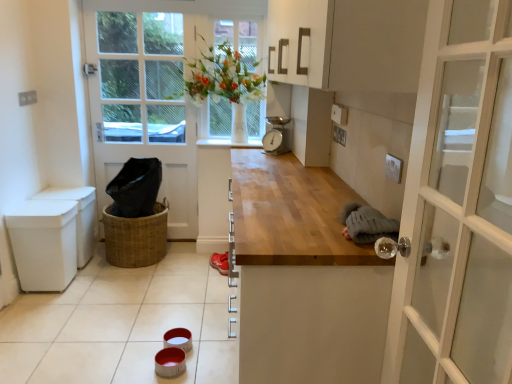
Question: Is translucent glass window at center outside of metallic gray scale at upper center?

Choices:
 (A) yes
 (B) no

Answer: (A)

Question: Considering the relative positions of translucent glass window at center and metallic gray scale at upper center in the image provided, is translucent glass window at center to the right of metallic gray scale at upper center from the viewer's perspective?

Choices:
 (A) no
 (B) yes

Answer: (A)

Question: Considering the relative sizes of translucent glass window at center and metallic gray scale at upper center in the image provided, is translucent glass window at center shorter than metallic gray scale at upper center?

Choices:
 (A) no
 (B) yes

Answer: (A)

Question: Would you consider translucent glass window at center to be distant from metallic gray scale at upper center?

Choices:
 (A) no
 (B) yes

Answer: (A)

Question: Considering the relative sizes of translucent glass window at center and metallic gray scale at upper center in the image provided, is translucent glass window at center thinner than metallic gray scale at upper center?

Choices:
 (A) yes
 (B) no

Answer: (A)

Question: From the image's perspective, is translucent glass window at center on metallic gray scale at upper center?

Choices:
 (A) no
 (B) yes

Answer: (B)

Question: Does metallic gray scale at upper center turn towards white glossy tile at lower center?

Choices:
 (A) no
 (B) yes

Answer: (A)

Question: Is metallic gray scale at upper center positioned beyond the bounds of white glossy tile at lower center?

Choices:
 (A) no
 (B) yes

Answer: (B)

Question: From a real-world perspective, is metallic gray scale at upper center physically above white glossy tile at lower center?

Choices:
 (A) yes
 (B) no

Answer: (A)

Question: Does metallic gray scale at upper center have a smaller size compared to white glossy tile at lower center?

Choices:
 (A) no
 (B) yes

Answer: (B)

Question: Is metallic gray scale at upper center taller than white glossy tile at lower center?

Choices:
 (A) yes
 (B) no

Answer: (A)

Question: Is metallic gray scale at upper center directly adjacent to white glossy tile at lower center?

Choices:
 (A) no
 (B) yes

Answer: (A)

Question: Does white plastic bin at left appear on the left side of white glossy tile at lower center?

Choices:
 (A) no
 (B) yes

Answer: (B)